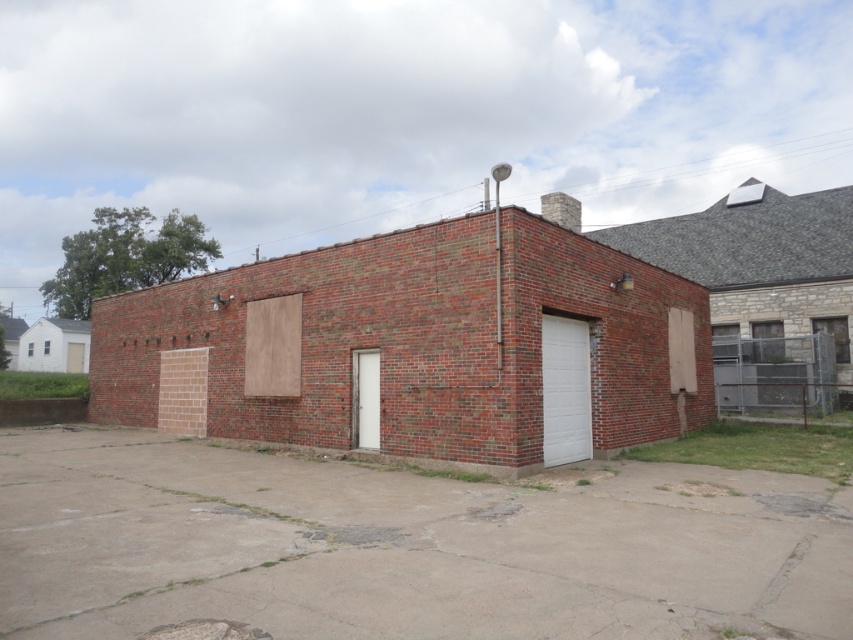
You are standing at the entrance of the building and want to walk towards the point labeled as point (555, 358). There is another point labeled point (590, 312) behind it. Which point should you aim for first to reach the second one?

You should aim for point (555, 358) first because it is in front of point (590, 312). Once you reach point (555, 358), you can then proceed to the point behind it, which is point (590, 312).